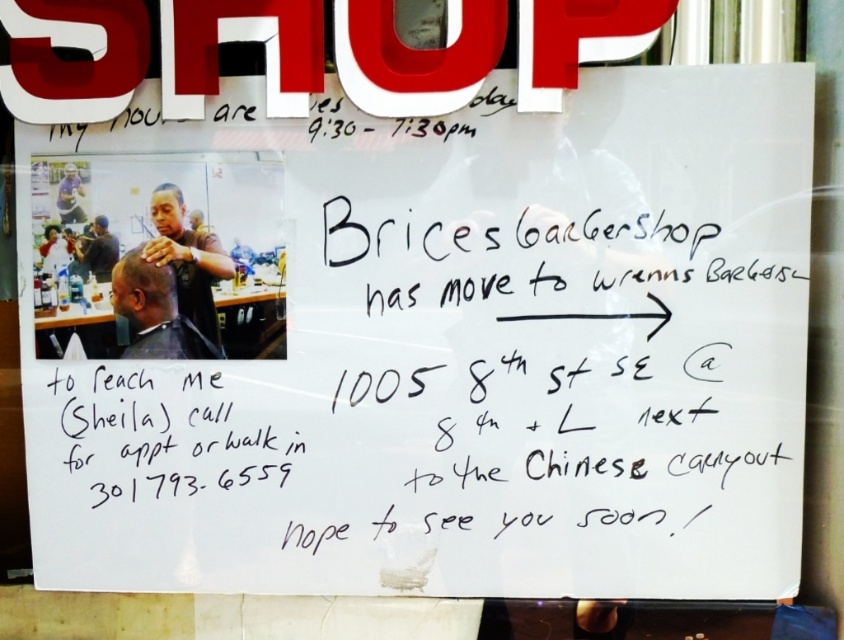
Question: Is dark brown hair at upper left to the left of matte black hair at upper left from the viewer's perspective?

Choices:
 (A) yes
 (B) no

Answer: (B)

Question: Which point appears farthest from the camera in this image?

Choices:
 (A) (143, 268)
 (B) (182, 257)
 (C) (190, 250)

Answer: (B)

Question: Which object is the farthest from the dark brown hair at upper left?

Choices:
 (A) matte black hair at upper left
 (B) matte black barber chair at upper left

Answer: (B)

Question: In this image, where is matte black barber at upper left located relative to dark brown hair at upper left?

Choices:
 (A) below
 (B) above

Answer: (B)

Question: Does matte black barber chair at upper left have a larger size compared to dark brown hair at center?

Choices:
 (A) no
 (B) yes

Answer: (B)

Question: Among these points, which one is nearest to the camera?

Choices:
 (A) (177, 291)
 (B) (101, 280)

Answer: (B)